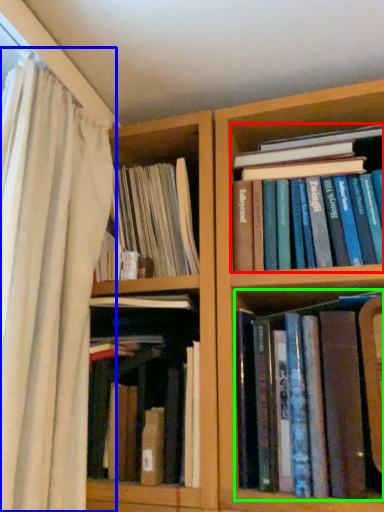
Question: Considering the real-world distances, which object is closest to book (highlighted by a red box)? curtain (highlighted by a blue box) or book (highlighted by a green box).

Choices:
 (A) curtain
 (B) book

Answer: (B)